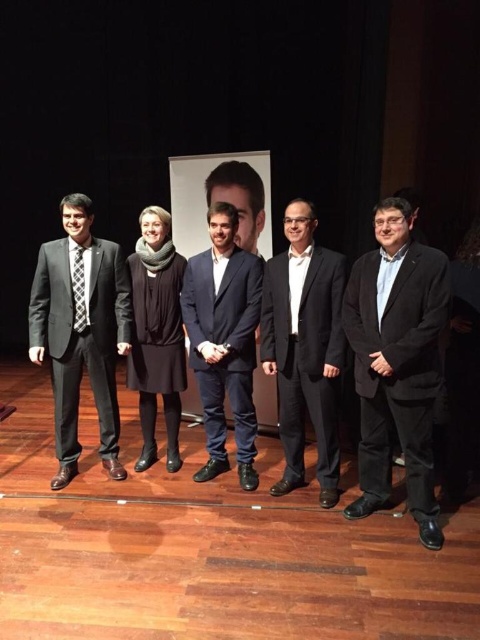
Consider the image. You are standing on the stage and want to place a small podium at the exact center of the wooden floor at lower center. Given the coordinates provided, where should you place the podium to ensure it is centered?

The wooden floor at lower center is positioned at coordinates point [207,550], so placing the podium at those coordinates would center it on the wooden floor at lower center.